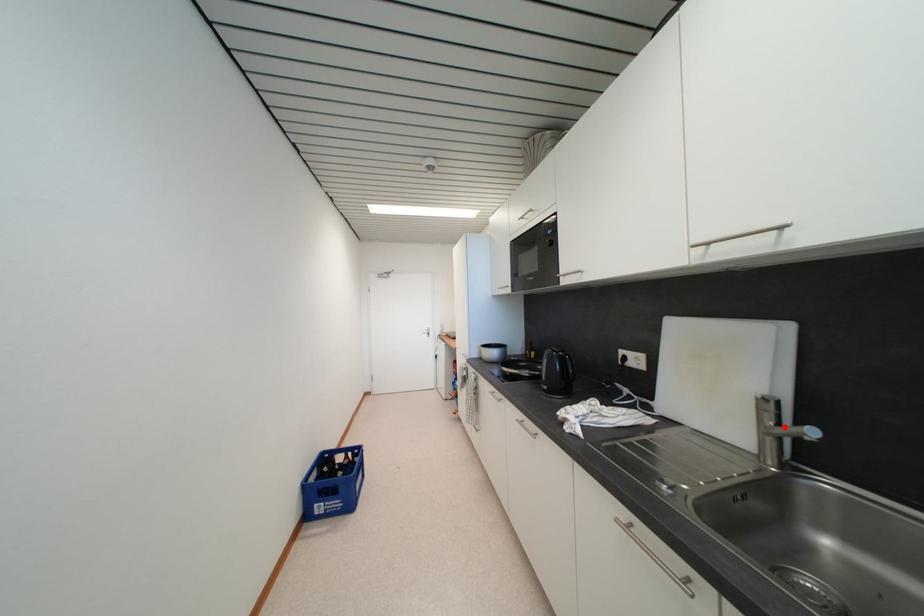
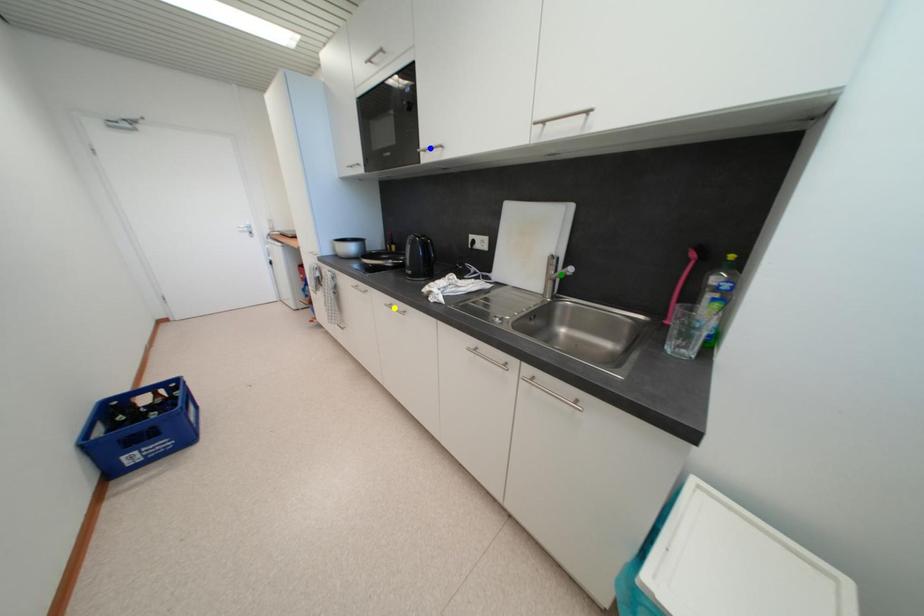
Question: I am providing you with two images of the same scene from different viewpoints. A red point is marked on the first image. You are given multiple points on the second image. Which mark in image 2 goes with the point in image 1?

Choices:
 (A) green point
 (B) yellow point
 (C) blue point

Answer: (A)